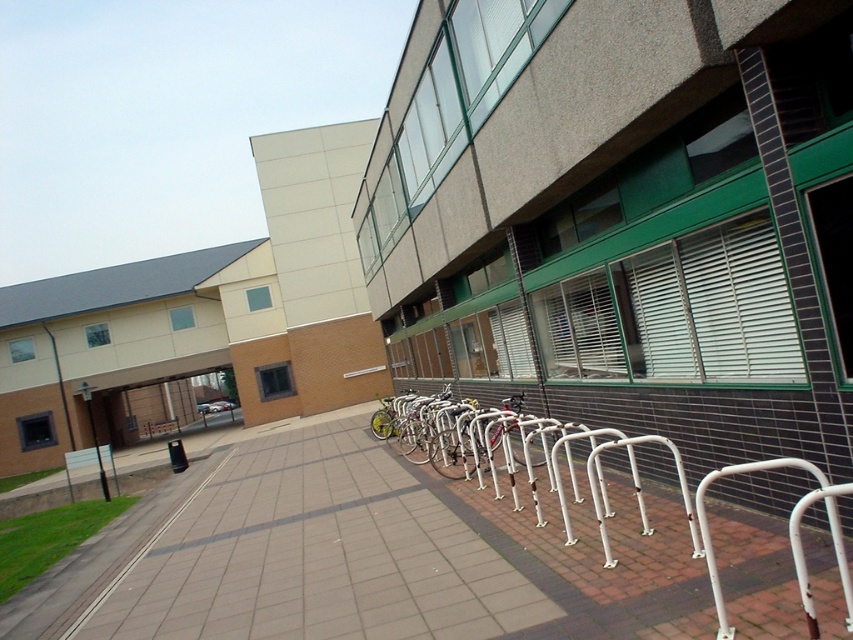
You are a delivery person trying to park your bike near the white metal bike rack at lower center. You notice the smooth concrete sidewalk at lower left nearby. Which object is shorter in height?

The white metal bike rack at lower center is not as tall as the smooth concrete sidewalk at lower left, so the white metal bike rack at lower center is shorter.

You are a delivery person who needs to park your bike in the silver metallic bicycle at center. The smooth concrete sidewalk at lower left is where you are currently standing. Can you move your bike from the current position to the bike rack without needing to go around any obstacles?

The smooth concrete sidewalk at lower left is smaller than the silver metallic bicycle at center. Since the sidewalk is smaller, there might not be enough space to maneuver the bike easily. You may need to go around obstacles to reach the bike rack.